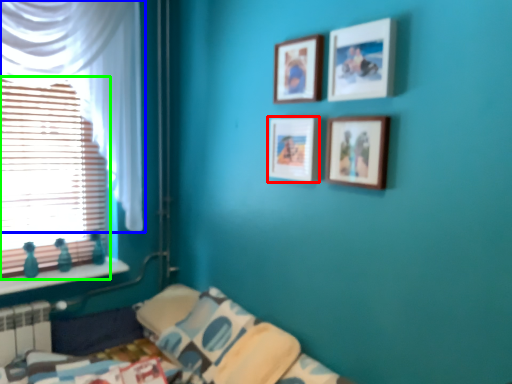
Question: Which object is the farthest from picture frame (highlighted by a red box)? Choose among these: curtain (highlighted by a blue box) or window (highlighted by a green box).

Choices:
 (A) curtain
 (B) window

Answer: (B)